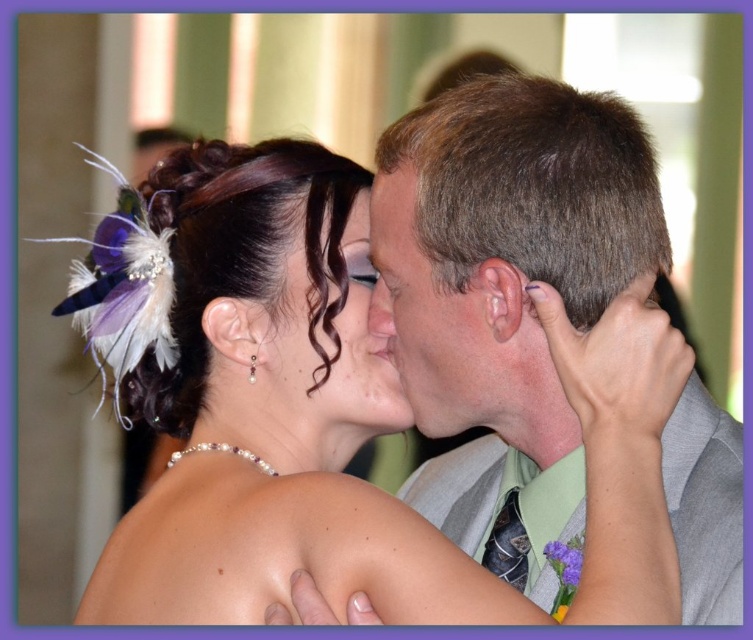
Can you confirm if pearl necklace at center is positioned above smooth skin nose at center?

No, pearl necklace at center is not above smooth skin nose at center.

Who is more forward, (x=273, y=301) or (x=373, y=314)?

Point (x=373, y=314) is in front.

Does point (578, 340) come behind point (386, 320)?

That is False.

Identify the location of pearl necklace at center. (258, 397).

Based on the photo, between matte gray suit at center and matte black hair at center, which one has less height?

matte gray suit at center is shorter.

Is point (456, 307) positioned before point (296, 396)?

Yes, it is.

Image resolution: width=753 pixels, height=640 pixels. I want to click on matte gray suit at center, so click(x=427, y=320).

Image resolution: width=753 pixels, height=640 pixels. In order to click on gray fabric suit at center in this screenshot , I will do `click(508, 292)`.

Does gray fabric suit at center have a greater height compared to smooth skin nose at center?

Indeed, gray fabric suit at center has a greater height compared to smooth skin nose at center.

Which is behind, point (511, 518) or point (380, 288)?

The point (511, 518) is more distant.

At what (x,y) coordinates should I click in order to perform the action: click on gray fabric suit at center. Please return your answer as a coordinate pair (x, y). This screenshot has width=753, height=640. Looking at the image, I should click on (508, 292).